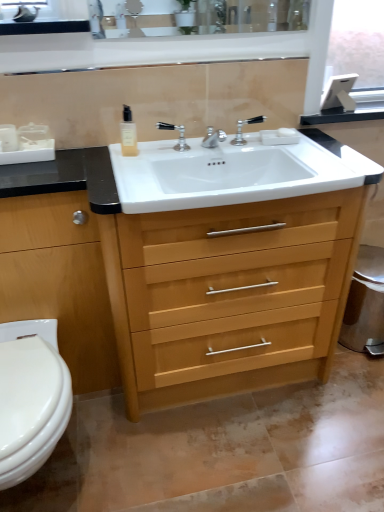
The height and width of the screenshot is (512, 384). I want to click on vacant area that is situated to the right of clear glass soap dispenser at upper center, so click(x=160, y=152).